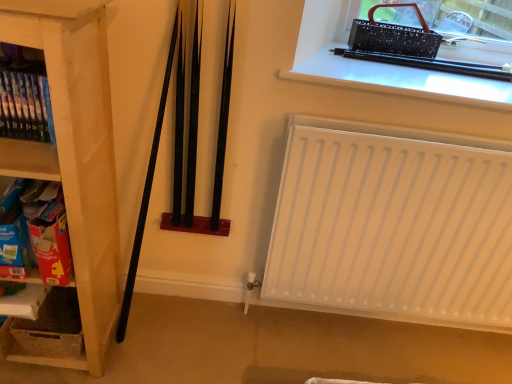
What is the approximate width of black plastic pen at upper right?

It is 20.29 inches.

I want to click on wooden bookshelf at left, placed as the first shelf when sorted from top to bottom, so click(x=26, y=115).

In order to face cardboard box at left, the third shelf when ordered from top to bottom, should I rotate leftwards or rightwards?

To align with it, rotate left about 29.121°.

Image resolution: width=512 pixels, height=384 pixels. What do you see at coordinates (72, 169) in the screenshot? I see `wooden shelf at left, which is the 2th shelf in bottom-to-top order` at bounding box center [72, 169].

Describe the element at coordinates (47, 329) in the screenshot. I see `white cardboard box at lower left` at that location.

Locate an element on the screen. Image resolution: width=512 pixels, height=384 pixels. white cardboard box at lower left is located at coordinates (47, 329).

At what (x,y) coordinates should I click in order to perform the action: click on black plastic pen at upper right. Please return your answer as a coordinate pair (x, y). The width and height of the screenshot is (512, 384). Looking at the image, I should click on (379, 66).

Which object is closer to the camera, wooden bookshelf at left, which ranks as the third shelf in bottom-to-top order, or white matte radiator at lower right?

wooden bookshelf at left, which ranks as the third shelf in bottom-to-top order.

Is white matte radiator at lower right surrounded by wooden bookshelf at left, placed as the first shelf when sorted from top to bottom?

No, white matte radiator at lower right is not inside wooden bookshelf at left, placed as the first shelf when sorted from top to bottom.

Which of these two, wooden bookshelf at left, which ranks as the third shelf in bottom-to-top order, or white matte radiator at lower right, stands taller?

white matte radiator at lower right.

The width and height of the screenshot is (512, 384). What are the coordinates of `the 1st shelf counting from the left side of the white matte radiator at lower right` in the screenshot? It's located at (26, 115).

Considering the relative sizes of white cardboard box at lower left and white matte radiator at lower right in the image provided, is white cardboard box at lower left taller than white matte radiator at lower right?

No, white cardboard box at lower left is not taller than white matte radiator at lower right.

Is white cardboard box at lower left situated inside white matte radiator at lower right or outside?

white cardboard box at lower left exists outside the volume of white matte radiator at lower right.

From a real-world perspective, is white cardboard box at lower left on white matte radiator at lower right?

Incorrect, from a real-world perspective, white cardboard box at lower left is lower than white matte radiator at lower right.

Is black plastic pen at upper right placed right next to wooden bookshelf at left, placed as the first shelf when sorted from top to bottom?

No, black plastic pen at upper right is not touching wooden bookshelf at left, placed as the first shelf when sorted from top to bottom.

Considering the sizes of black plastic pen at upper right and wooden bookshelf at left, placed as the first shelf when sorted from top to bottom, in the image, is black plastic pen at upper right bigger or smaller than wooden bookshelf at left, placed as the first shelf when sorted from top to bottom,?

In the image, black plastic pen at upper right appears to be larger than wooden bookshelf at left, placed as the first shelf when sorted from top to bottom.

Is black plastic pen at upper right oriented away from wooden bookshelf at left, placed as the first shelf when sorted from top to bottom?

No, black plastic pen at upper right is not facing away from wooden bookshelf at left, placed as the first shelf when sorted from top to bottom.

How much distance is there between black plastic pen at upper right and wooden bookshelf at left, placed as the first shelf when sorted from top to bottom?

black plastic pen at upper right is 84.09 centimeters away from wooden bookshelf at left, placed as the first shelf when sorted from top to bottom.

From the image's perspective, which is below, white cardboard box at lower left or black plastic pen at upper right?

white cardboard box at lower left is shown below in the image.

Is white cardboard box at lower left shorter than black plastic pen at upper right?

In fact, white cardboard box at lower left may be taller than black plastic pen at upper right.

From the picture: What's the angular difference between white cardboard box at lower left and black plastic pen at upper right's facing directions?

The facing directions of white cardboard box at lower left and black plastic pen at upper right are 0.238 degrees apart.

Is white cardboard box at lower left completely or partially outside of black plastic pen at upper right?

Yes, white cardboard box at lower left is located beyond the bounds of black plastic pen at upper right.

Considering the positions of objects white cardboard box at lower left and wooden shelf at left, which is the 2th shelf in bottom-to-top order, in the image provided, who is in front, white cardboard box at lower left or wooden shelf at left, which is the 2th shelf in bottom-to-top order,?

wooden shelf at left, which is the 2th shelf in bottom-to-top order, is more forward.

From a real-world perspective, is white cardboard box at lower left over wooden shelf at left, which is the 2th shelf in bottom-to-top order?

No, from a real-world perspective, white cardboard box at lower left is not on top of wooden shelf at left, which is the 2th shelf in bottom-to-top order.

Is white cardboard box at lower left oriented away from wooden shelf at left, which ranks as the 2th shelf in top-to-bottom order?

Yes, white cardboard box at lower left's orientation is away from wooden shelf at left, which ranks as the 2th shelf in top-to-bottom order.

Can you tell me how much white cardboard box at lower left and wooden shelf at left, which ranks as the 2th shelf in top-to-bottom order, differ in facing direction?

2.5 degrees separate the facing orientations of white cardboard box at lower left and wooden shelf at left, which ranks as the 2th shelf in top-to-bottom order.

Is wooden shelf at left, which ranks as the 2th shelf in top-to-bottom order, turned away from cardboard box at left, the third shelf when ordered from top to bottom?

Yes, wooden shelf at left, which ranks as the 2th shelf in top-to-bottom order,'s orientation is away from cardboard box at left, the third shelf when ordered from top to bottom.

Are wooden shelf at left, which ranks as the 2th shelf in top-to-bottom order, and cardboard box at left, the first shelf from the bottom, beside each other?

No, wooden shelf at left, which ranks as the 2th shelf in top-to-bottom order, is not beside cardboard box at left, the first shelf from the bottom.

From a real-world perspective, is wooden shelf at left, which is the 2th shelf in bottom-to-top order, below cardboard box at left, the first shelf from the bottom?

No, from a real-world perspective, wooden shelf at left, which is the 2th shelf in bottom-to-top order, is not under cardboard box at left, the first shelf from the bottom.

In the scene shown: Considering the sizes of objects wooden shelf at left, which is the 2th shelf in bottom-to-top order, and cardboard box at left, the first shelf from the bottom, in the image provided, who is thinner, wooden shelf at left, which is the 2th shelf in bottom-to-top order, or cardboard box at left, the first shelf from the bottom,?

Thinner between the two is cardboard box at left, the first shelf from the bottom.

From the image's perspective, is wooden shelf at left, which is the 2th shelf in bottom-to-top order, below black plastic pen at upper right?

Correct, wooden shelf at left, which is the 2th shelf in bottom-to-top order, appears lower than black plastic pen at upper right in the image.

Considering the sizes of objects wooden shelf at left, which ranks as the 2th shelf in top-to-bottom order, and black plastic pen at upper right in the image provided, who is thinner, wooden shelf at left, which ranks as the 2th shelf in top-to-bottom order, or black plastic pen at upper right?

wooden shelf at left, which ranks as the 2th shelf in top-to-bottom order.

Image resolution: width=512 pixels, height=384 pixels. Identify the location of window above the wooden shelf at left, which ranks as the 2th shelf in top-to-bottom order (from a real-world perspective). (379, 66).

From a real-world perspective, between wooden shelf at left, which is the 2th shelf in bottom-to-top order, and black plastic pen at upper right, who is vertically higher?

black plastic pen at upper right is physically above.

Identify the location of the 1st shelf to the left of the white matte radiator at lower right, starting your count from the anchor. (26, 115).

Where is `heater above the white cardboard box at lower left (from a real-world perspective)`? This screenshot has height=384, width=512. heater above the white cardboard box at lower left (from a real-world perspective) is located at coordinates (394, 225).

Considering their positions, is wooden shelf at left, which ranks as the 2th shelf in top-to-bottom order, positioned further to black plastic pen at upper right than cardboard box at left, the first shelf from the bottom?

The object further to black plastic pen at upper right is cardboard box at left, the first shelf from the bottom.

Which object lies further to the anchor point cardboard box at left, the third shelf when ordered from top to bottom, black plastic pen at upper right or wooden shelf at left, which ranks as the 2th shelf in top-to-bottom order?

Among the two, black plastic pen at upper right is located further to cardboard box at left, the third shelf when ordered from top to bottom.

From the image, which object appears to be nearer to white matte radiator at lower right, cardboard box at left, the first shelf from the bottom, or black plastic pen at upper right?

The object closer to white matte radiator at lower right is black plastic pen at upper right.

Estimate the real-world distances between objects in this image. Which object is further from wooden shelf at left, which ranks as the 2th shelf in top-to-bottom order, white matte radiator at lower right or cardboard box at left, the first shelf from the bottom?

white matte radiator at lower right.

Looking at this image, considering their positions, is wooden shelf at left, which ranks as the 2th shelf in top-to-bottom order, positioned further to white cardboard box at lower left than wooden bookshelf at left, which ranks as the third shelf in bottom-to-top order?

wooden bookshelf at left, which ranks as the third shelf in bottom-to-top order, is positioned further to the anchor white cardboard box at lower left.

Which object lies further to the anchor point cardboard box at left, the first shelf from the bottom, white cardboard box at lower left or wooden bookshelf at left, placed as the first shelf when sorted from top to bottom?

white cardboard box at lower left is further to cardboard box at left, the first shelf from the bottom.

From the image, which object appears to be farther from white matte radiator at lower right, white cardboard box at lower left or wooden shelf at left, which ranks as the 2th shelf in top-to-bottom order?

Based on the image, white cardboard box at lower left appears to be further to white matte radiator at lower right.

Which object lies further to the anchor point white cardboard box at lower left, wooden bookshelf at left, which ranks as the third shelf in bottom-to-top order, or black plastic pen at upper right?

black plastic pen at upper right is further to white cardboard box at lower left.

The width and height of the screenshot is (512, 384). I want to click on window between wooden bookshelf at left, placed as the first shelf when sorted from top to bottom, and white matte radiator at lower right, in the horizontal direction, so click(x=379, y=66).

You are a GUI agent. You are given a task and a screenshot of the screen. Output one action in this format:
    pyautogui.click(x=<x>, y=<y>)
    Task: Click on the window situated between wooden shelf at left, which is the 2th shelf in bottom-to-top order, and white matte radiator at lower right from left to right
    This screenshot has height=384, width=512.
    Given the screenshot: What is the action you would take?
    pyautogui.click(x=379, y=66)

Identify the location of storage box between wooden shelf at left, which is the 2th shelf in bottom-to-top order, and black plastic pen at upper right, in the horizontal direction. The height and width of the screenshot is (384, 512). (47, 329).

The height and width of the screenshot is (384, 512). What are the coordinates of `shelf located between wooden shelf at left, which is the 2th shelf in bottom-to-top order, and black plastic pen at upper right in the left-right direction` in the screenshot? It's located at (26, 115).